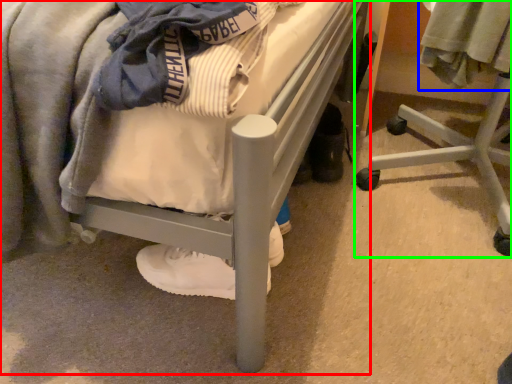
Question: Which object is positioned closest to bed (highlighted by a red box)? Select from clothing (highlighted by a blue box) and furniture (highlighted by a green box).

Choices:
 (A) clothing
 (B) furniture

Answer: (A)